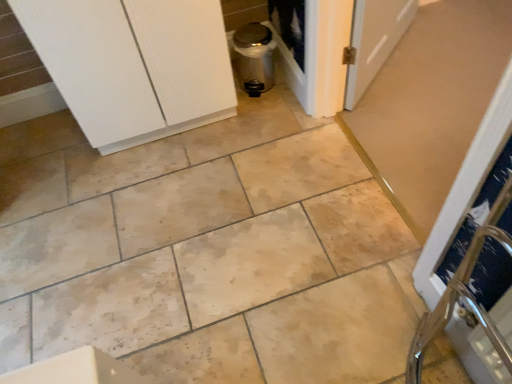
Image resolution: width=512 pixels, height=384 pixels. Identify the location of metallic silver screen door at center. (295, 43).

In order to click on white textured cabinet at upper left in this screenshot , I will do `click(134, 65)`.

Locate an element on the screen. This screenshot has height=384, width=512. satin silver trash can at center is located at coordinates (254, 57).

Who is smaller, metallic silver screen door at center or white textured cabinet at upper left?

Smaller between the two is metallic silver screen door at center.

Is metallic silver screen door at center aimed at white textured cabinet at upper left?

Yes, metallic silver screen door at center is facing white textured cabinet at upper left.

Considering the positions of objects metallic silver screen door at center and white textured cabinet at upper left in the image provided, who is more to the right, metallic silver screen door at center or white textured cabinet at upper left?

metallic silver screen door at center.

What are the coordinates of `door that is in front of the metallic silver screen door at center` in the screenshot? It's located at (134, 65).

Considering the relative sizes of white textured cabinet at upper left and metallic silver screen door at center in the image provided, is white textured cabinet at upper left wider than metallic silver screen door at center?

Correct, the width of white textured cabinet at upper left exceeds that of metallic silver screen door at center.

Is white textured cabinet at upper left in front of or behind metallic silver screen door at center in the image?

white textured cabinet at upper left is positioned closer to the viewer than metallic silver screen door at center.

From a real-world perspective, relative to metallic silver screen door at center, is white textured cabinet at upper left vertically above or below?

Clearly, from a real-world perspective, white textured cabinet at upper left is above metallic silver screen door at center.

Considering the relative sizes of metallic silver screen door at center and satin silver trash can at center in the image provided, is metallic silver screen door at center smaller than satin silver trash can at center?

Correct, metallic silver screen door at center occupies less space than satin silver trash can at center.

Measure the distance from metallic silver screen door at center to satin silver trash can at center.

metallic silver screen door at center is 7.97 inches from satin silver trash can at center.

Can you confirm if metallic silver screen door at center is positioned to the left of satin silver trash can at center?

No, metallic silver screen door at center is not to the left of satin silver trash can at center.

Can you tell me how much metallic silver screen door at center and satin silver trash can at center differ in facing direction?

The facing directions of metallic silver screen door at center and satin silver trash can at center are 87.5 degrees apart.

Is satin silver trash can at center shorter than white textured cabinet at upper left?

Yes, satin silver trash can at center is shorter than white textured cabinet at upper left.

Can you tell me how much satin silver trash can at center and white textured cabinet at upper left differ in facing direction?

They differ by 3.17 degrees in their facing directions.

Considering the relative sizes of satin silver trash can at center and white textured cabinet at upper left in the image provided, is satin silver trash can at center wider than white textured cabinet at upper left?

Incorrect, the width of satin silver trash can at center does not surpass that of white textured cabinet at upper left.

From the image's perspective, is satin silver trash can at center located beneath white textured cabinet at upper left?

No, from the image's perspective, satin silver trash can at center is not beneath white textured cabinet at upper left.

Between satin silver trash can at center and metallic silver screen door at center, which one has smaller width?

metallic silver screen door at center is thinner.

From a real-world perspective, which object stands above the other?

satin silver trash can at center, from a real-world perspective.

How much distance is there between satin silver trash can at center and metallic silver screen door at center?

satin silver trash can at center is 7.97 inches from metallic silver screen door at center.

You are a GUI agent. You are given a task and a screenshot of the screen. Output one action in this format:
    pyautogui.click(x=<x>, y=<y>)
    Task: Click on the appliance above the metallic silver screen door at center (from the image's perspective)
    The height and width of the screenshot is (384, 512).
    Given the screenshot: What is the action you would take?
    pyautogui.click(x=254, y=57)

Is white textured cabinet at upper left far from satin silver trash can at center?

No, white textured cabinet at upper left is not far from satin silver trash can at center.

Is satin silver trash can at center completely or partially inside white textured cabinet at upper left?

No, satin silver trash can at center is not inside white textured cabinet at upper left.

What's the angular difference between white textured cabinet at upper left and satin silver trash can at center's facing directions?

They differ by 3.17 degrees in their facing directions.

Locate an element on the screen. screen door located on the right of white textured cabinet at upper left is located at coordinates (295, 43).

Locate an element on the screen. The width and height of the screenshot is (512, 384). screen door lying below the white textured cabinet at upper left (from the image's perspective) is located at coordinates (295, 43).

Which object lies nearer to the anchor point white textured cabinet at upper left, satin silver trash can at center or metallic silver screen door at center?

Among the two, satin silver trash can at center is located nearer to white textured cabinet at upper left.

Estimate the real-world distances between objects in this image. Which object is closer to satin silver trash can at center, metallic silver screen door at center or white textured cabinet at upper left?

Based on the image, metallic silver screen door at center appears to be nearer to satin silver trash can at center.

Looking at the image, which one is located closer to white textured cabinet at upper left, metallic silver screen door at center or satin silver trash can at center?

satin silver trash can at center is positioned closer to the anchor white textured cabinet at upper left.

Which object lies nearer to the anchor point metallic silver screen door at center, satin silver trash can at center or white textured cabinet at upper left?

satin silver trash can at center.

From the image, which object appears to be nearer to metallic silver screen door at center, white textured cabinet at upper left or satin silver trash can at center?

satin silver trash can at center is closer to metallic silver screen door at center.

Considering their positions, is white textured cabinet at upper left positioned further to satin silver trash can at center than metallic silver screen door at center?

Among the two, white textured cabinet at upper left is located further to satin silver trash can at center.

Where is `appliance between white textured cabinet at upper left and metallic silver screen door at center from left to right`? This screenshot has width=512, height=384. appliance between white textured cabinet at upper left and metallic silver screen door at center from left to right is located at coordinates (254, 57).